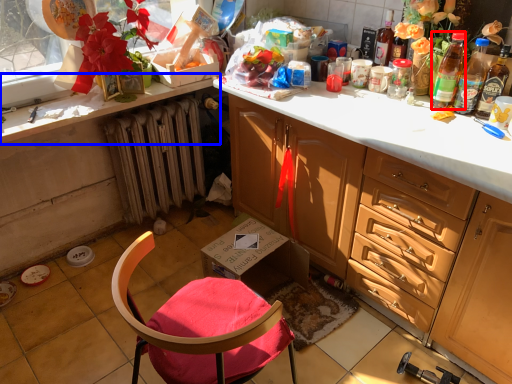
Question: Which point is closer to the camera, bottle (highlighted by a red box) or countertop (highlighted by a blue box)?

Choices:
 (A) bottle
 (B) countertop

Answer: (A)